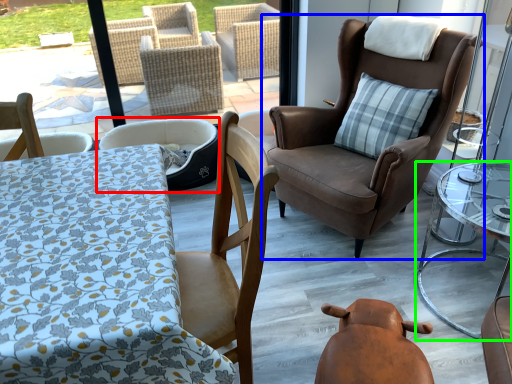
Question: Considering the real-world distances, which object is closest to chair (highlighted by a red box)? chair (highlighted by a blue box) or table (highlighted by a green box).

Choices:
 (A) chair
 (B) table

Answer: (A)